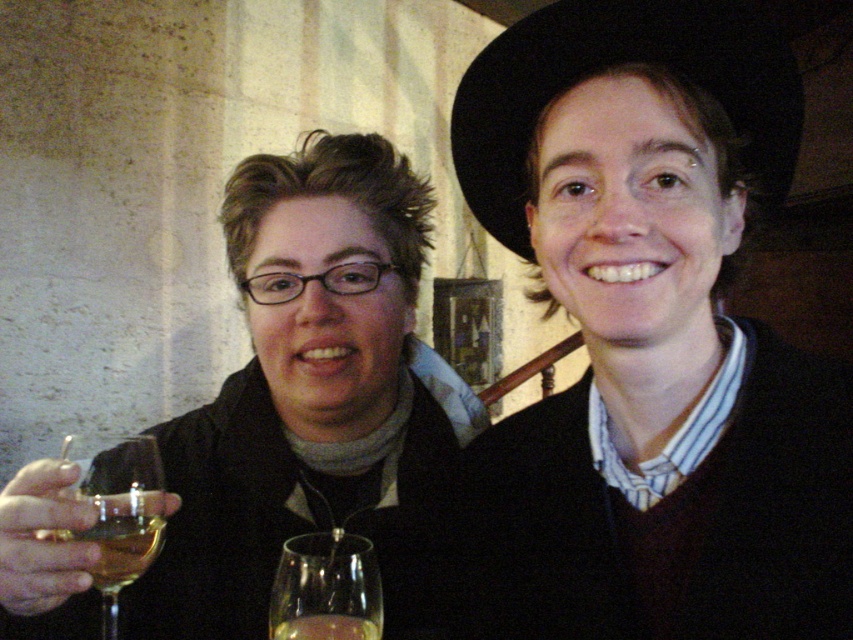
You are a photographer adjusting the camera settings to capture the scene. The matte black jacket at left and the clear glass wine glass at lower left are both in the frame. Which object should you focus on first if you want to ensure both are in focus, considering their positions relative to the camera?

You should focus on the matte black jacket at left first because it is closer to the camera than the clear glass wine glass at lower left, ensuring both will be in focus.

You are a photographer setting up for a group photo. You need to ensure that the matte black jacket at left and the translucent glass wine at center are at least 14 inches apart to avoid overlapping in the photo. Based on the current setup, is this requirement met?

The matte black jacket at left and the translucent glass wine at center are currently 12.98 inches apart, which is less than the required 14 inches. Therefore, the requirement is not met, and adjustments are needed to increase the distance between them.

You are an interior designer analyzing the placement of objects in the scene. The clear glass wine glass at lower left is positioned at coordinates 0.798, 0.138. If you were to place a decorative plate at coordinate 0.8, 0.14, would it overlap with the wine glass?

The clear glass wine glass at lower left is located at point (117, 509). The decorative plate at (119, 512) is very close but not exactly overlapping, so they might not overlap depending on their sizes. However, the exact overlap cannot be determined without knowing the objects sizes.